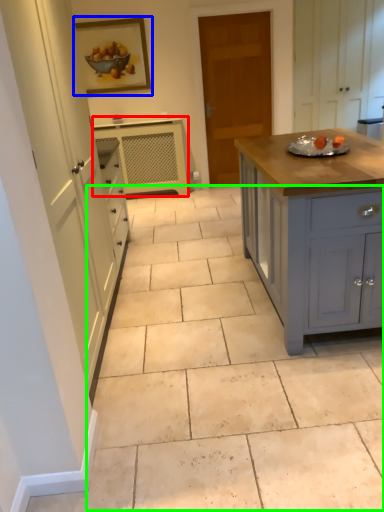
Question: Which object is positioned farthest from cabinetry (highlighted by a red box)? Select from picture frame (highlighted by a blue box) and path (highlighted by a green box).

Choices:
 (A) picture frame
 (B) path

Answer: (B)